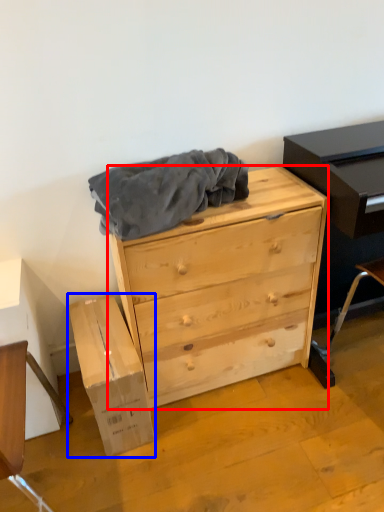
Question: Among these objects, which one is farthest to the camera, chest of drawers (highlighted by a red box) or cardboard box (highlighted by a blue box)?

Choices:
 (A) chest of drawers
 (B) cardboard box

Answer: (B)